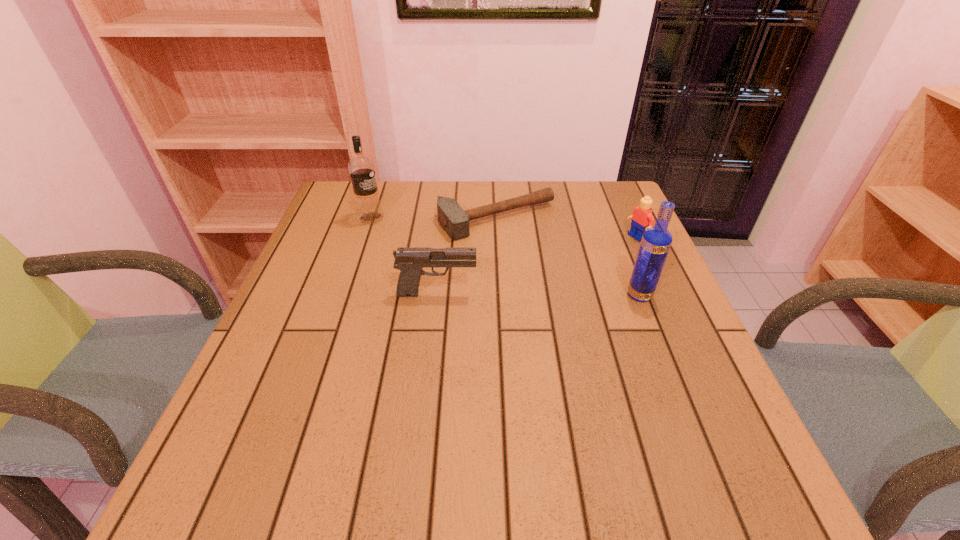
You are a GUI agent. You are given a task and a screenshot of the screen. Output one action in this format:
    pyautogui.click(x=<x>, y=<y>)
    Task: Click on the vodka positioned at the right edge
    The width and height of the screenshot is (960, 540).
    Given the screenshot: What is the action you would take?
    pyautogui.click(x=656, y=241)

Image resolution: width=960 pixels, height=540 pixels. I want to click on Lego at the right edge, so click(x=642, y=217).

This screenshot has height=540, width=960. In order to click on object present at the far left corner in this screenshot , I will do click(x=361, y=168).

The width and height of the screenshot is (960, 540). I want to click on vacant space at the far edge of the desktop, so click(522, 208).

Find the location of `vacant space at the left edge`. vacant space at the left edge is located at coordinates (319, 350).

Find the location of a particular element. The height and width of the screenshot is (540, 960). blank area at the right edge is located at coordinates (629, 271).

In the image, there is a desktop. Where is `vacant space at the far left corner`? This screenshot has height=540, width=960. vacant space at the far left corner is located at coordinates (384, 205).

You are a GUI agent. You are given a task and a screenshot of the screen. Output one action in this format:
    pyautogui.click(x=<x>, y=<y>)
    Task: Click on the vacant space at the far right corner of the desktop
    This screenshot has height=540, width=960.
    Given the screenshot: What is the action you would take?
    pyautogui.click(x=583, y=220)

Where is `free space at the near right corner of the desktop`? This screenshot has height=540, width=960. free space at the near right corner of the desktop is located at coordinates (710, 426).

Where is `free space between the pistol and the nearer vodka`? The image size is (960, 540). free space between the pistol and the nearer vodka is located at coordinates 539,294.